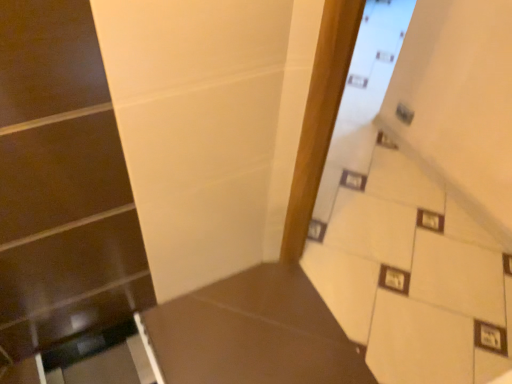
Question: Considering their positions, is brown matte table at lower left located in front of or behind white tile stairwell at upper right?

Choices:
 (A) front
 (B) behind

Answer: (B)

Question: Considering the positions of brown matte table at lower left and white tile stairwell at upper right in the image, is brown matte table at lower left taller or shorter than white tile stairwell at upper right?

Choices:
 (A) short
 (B) tall

Answer: (A)

Question: Based on their sizes in the image, would you say brown matte table at lower left is bigger or smaller than white tile stairwell at upper right?

Choices:
 (A) big
 (B) small

Answer: (B)

Question: Is white tile stairwell at upper right wider or thinner than brown matte table at lower left?

Choices:
 (A) thin
 (B) wide

Answer: (A)

Question: Is point (352, 314) positioned closer to the camera than point (243, 372)?

Choices:
 (A) closer
 (B) farther

Answer: (B)

Question: Is white tile stairwell at upper right situated inside brown matte table at lower left or outside?

Choices:
 (A) outside
 (B) inside

Answer: (A)

Question: From a real-world perspective, is white tile stairwell at upper right above or below brown matte table at lower left?

Choices:
 (A) above
 (B) below

Answer: (A)